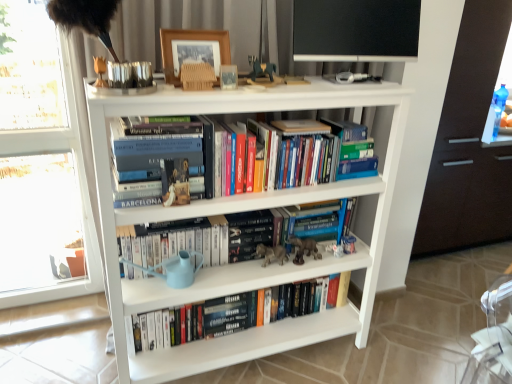
Measure the distance between dark brown wood drawer at right and camera.

The depth of dark brown wood drawer at right is 2.56 meters.

You are a GUI agent. You are given a task and a screenshot of the screen. Output one action in this format:
    pyautogui.click(x=<x>, y=<y>)
    Task: Click on the white matte bookshelf at center
    This screenshot has height=384, width=512.
    Given the screenshot: What is the action you would take?
    pyautogui.click(x=238, y=211)

Locate an element on the screen. black matte paperback book at center is located at coordinates (248, 233).

The width and height of the screenshot is (512, 384). In order to click on wooden picture frame at upper center in this screenshot , I will do `click(193, 50)`.

Describe the element at coordinates (469, 143) in the screenshot. The image size is (512, 384). I see `transparent glass screen door at right` at that location.

The width and height of the screenshot is (512, 384). Identify the location of dark brown wood drawer at right. [x=465, y=200].

From the image's perspective, which is above, wooden picture frame at upper center or black matte paperback book at center?

wooden picture frame at upper center, from the image's perspective.

The image size is (512, 384). I want to click on picture frame above the black matte paperback book at center (from the image's perspective), so click(x=193, y=50).

Is hardcover books at center left positioned with its back to white matte bookshelf at center?

Absolutely, hardcover books at center left is directed away from white matte bookshelf at center.

Is the position of hardcover books at center left more distant than that of white matte bookshelf at center?

Yes, the depth of hardcover books at center left is greater than that of white matte bookshelf at center.

Which object is thinner, hardcover books at center left or wooden picture frame at upper center?

wooden picture frame at upper center.

Does hardcover books at center left have a greater height compared to wooden picture frame at upper center?

Yes, hardcover books at center left is taller than wooden picture frame at upper center.

Is hardcover books at center left oriented towards wooden picture frame at upper center?

No, hardcover books at center left is not oriented towards wooden picture frame at upper center.

From the image's perspective, is hardcover books at center left below wooden picture frame at upper center?

Yes, from the image's perspective, hardcover books at center left is beneath wooden picture frame at upper center.

In the image, is matte brown figurine at center positioned in front of or behind transparent glass screen door at right?

Clearly, matte brown figurine at center is in front of transparent glass screen door at right.

You are a GUI agent. You are given a task and a screenshot of the screen. Output one action in this format:
    pyautogui.click(x=<x>, y=<y>)
    Task: Click on the screen door on the right side of matte brown figurine at center
    
    Given the screenshot: What is the action you would take?
    pyautogui.click(x=469, y=143)

Which point is more forward, (x=302, y=242) or (x=431, y=241)?

The point (x=302, y=242) is closer to the camera.

Is the surface of matte brown figurine at center in direct contact with transparent glass screen door at right?

matte brown figurine at center and transparent glass screen door at right are clearly separated.

Which object is positioned more to the left, black matte paperback book at center or dark brown wood drawer at right?

From the viewer's perspective, black matte paperback book at center appears more on the left side.

Is black matte paperback book at center oriented away from dark brown wood drawer at right?

No, black matte paperback book at center is not facing the opposite direction of dark brown wood drawer at right.

From a real-world perspective, is black matte paperback book at center located beneath dark brown wood drawer at right?

No, from a real-world perspective, black matte paperback book at center is not under dark brown wood drawer at right.

Consider the image. Considering the sizes of objects black matte paperback book at center and dark brown wood drawer at right in the image provided, who is smaller, black matte paperback book at center or dark brown wood drawer at right?

black matte paperback book at center.

Is black matte paperback book at center taller or shorter than matte brown figurine at center?

black matte paperback book at center is taller than matte brown figurine at center.

Is black matte paperback book at center next to matte brown figurine at center and touching it?

No, black matte paperback book at center is not in contact with matte brown figurine at center.

From a real-world perspective, is black matte paperback book at center positioned over matte brown figurine at center based on gravity?

Yes, from a real-world perspective, black matte paperback book at center is above matte brown figurine at center.

Which object is wider, black matte paperback book at center or black matte computer monitor at upper center?

black matte paperback book at center is wider.

From the image's perspective, does black matte paperback book at center appear lower than black matte computer monitor at upper center?

Yes.

Considering the sizes of black matte paperback book at center and black matte computer monitor at upper center in the image, is black matte paperback book at center taller or shorter than black matte computer monitor at upper center?

Clearly, black matte paperback book at center is shorter compared to black matte computer monitor at upper center.

The height and width of the screenshot is (384, 512). I want to click on computer monitor above the black matte paperback book at center (from the image's perspective), so click(x=356, y=30).

Locate an element on the screen. picture frame above the black matte paperback book at center (from the image's perspective) is located at coordinates (193, 50).

I want to click on shelf that is on the right side of hardcover books at center left, so click(238, 211).

Estimate the real-world distances between objects in this image. Which object is closer to black matte paperback book at center, black matte computer monitor at upper center or dark brown wood drawer at right?

Among the two, black matte computer monitor at upper center is located nearer to black matte paperback book at center.

Based on their spatial positions, is black matte computer monitor at upper center or transparent glass screen door at right further from white matte bookshelf at center?

The object further to white matte bookshelf at center is transparent glass screen door at right.

Estimate the real-world distances between objects in this image. Which object is closer to black matte paperback book at center, transparent glass screen door at right or hardcover books at center left?

The object closer to black matte paperback book at center is hardcover books at center left.

Which object lies nearer to the anchor point white matte bookshelf at center, black matte paperback book at center or transparent glass screen door at right?

The object closer to white matte bookshelf at center is black matte paperback book at center.

From the image, which object appears to be nearer to hardcover books at center left, wooden picture frame at upper center or white matte bookshelf at center?

Among the two, wooden picture frame at upper center is located nearer to hardcover books at center left.

Considering their positions, is black matte paperback book at center positioned closer to wooden picture frame at upper center than black matte computer monitor at upper center?

The object closer to wooden picture frame at upper center is black matte computer monitor at upper center.

Considering their positions, is white matte bookshelf at center positioned closer to transparent glass screen door at right than matte brown figurine at center?

white matte bookshelf at center is closer to transparent glass screen door at right.

Considering their positions, is white matte bookshelf at center positioned further to black matte computer monitor at upper center than hardcover books at center left?

Among the two, hardcover books at center left is located further to black matte computer monitor at upper center.

Where is `shelf between white plastic window frame at left and matte brown figurine at center`? shelf between white plastic window frame at left and matte brown figurine at center is located at coordinates (238, 211).

The height and width of the screenshot is (384, 512). What are the coordinates of `picture frame located between hardcover books at center left and transparent glass screen door at right in the left-right direction` in the screenshot? It's located at (193, 50).

Identify the location of screen door between wooden picture frame at upper center and dark brown wood drawer at right. The height and width of the screenshot is (384, 512). (469, 143).

Identify the location of animal between white matte bookshelf at center and transparent glass screen door at right from left to right. (304, 249).